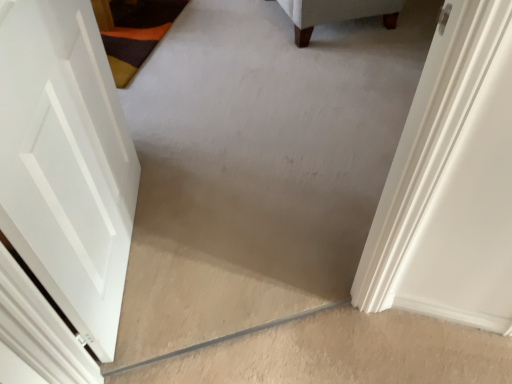
The image size is (512, 384). What do you see at coordinates (136, 33) in the screenshot?
I see `multicolored carpet at upper left` at bounding box center [136, 33].

This screenshot has width=512, height=384. Identify the location of multicolored carpet at upper left. (136, 33).

Locate an element on the screen. The image size is (512, 384). multicolored carpet at upper left is located at coordinates (136, 33).